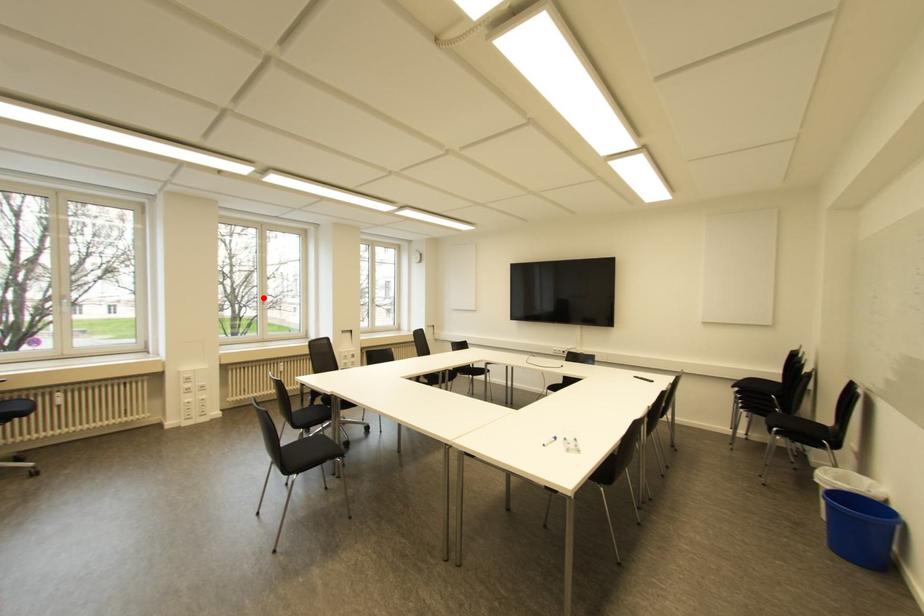
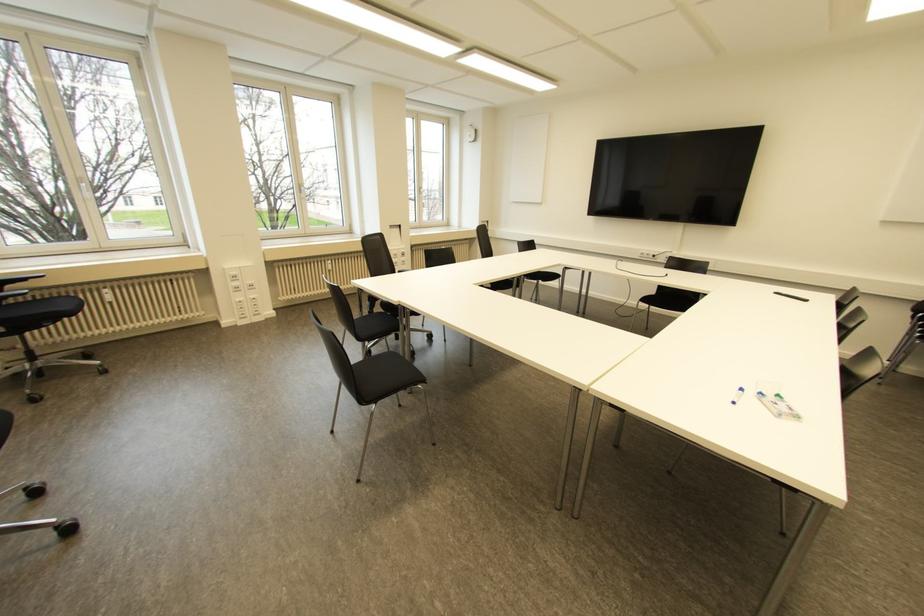
Find the pixel in the second image that matches the highlighted location in the first image.

(299, 185)